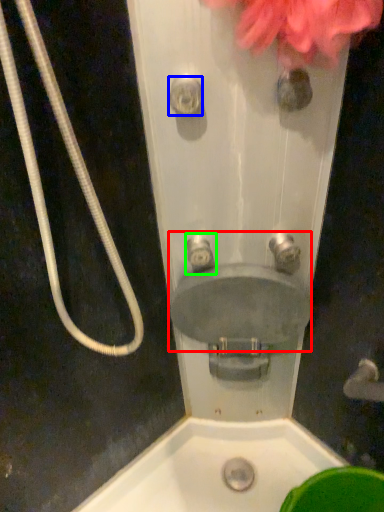
Question: Estimate the real-world distances between objects in this image. Which object is closer to sink (highlighted by a red box), shower (highlighted by a blue box) or plumbing fixture (highlighted by a green box)?

Choices:
 (A) shower
 (B) plumbing fixture

Answer: (B)